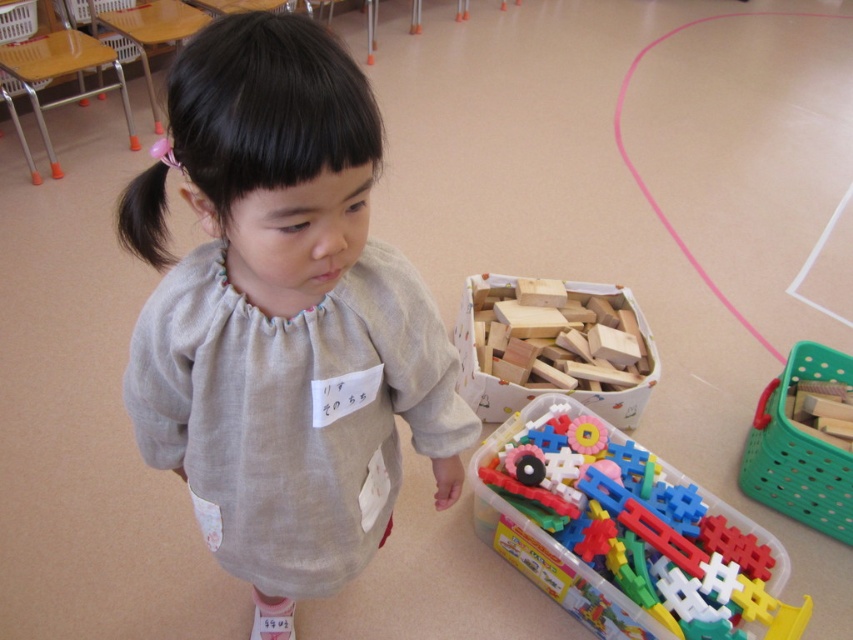
You are a teacher observing a classroom scene. You notice the gray cotton shirt at center and the green plastic basket at right. Which object is taller?

The gray cotton shirt at center is taller than the green plastic basket at right.

You are a teacher in a classroom and you see the plastic colorful blocks at lower right and the wooden blocks at center. Which one is closer to the ground?

The plastic colorful blocks at lower right is positioned under wooden blocks at center, so it is closer to the ground.

You are a parent trying to organize the toys in the room. The gray cotton shirt at center has a small pocket on the left side. Can you fit the green plastic basket at right into the pocket?

The gray cotton shirt at center and green plastic basket at right are 1.32 meters apart, so the green plastic basket at right is too large to fit into the small pocket of the gray cotton shirt at center.